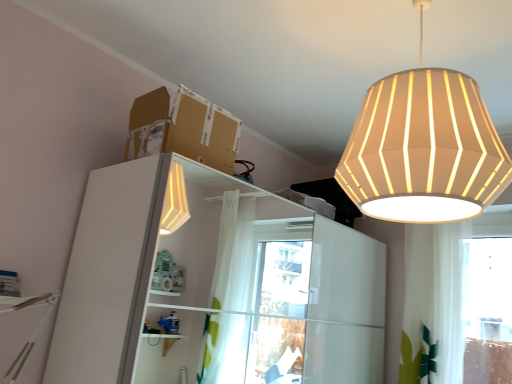
Question: Does white glossy dresser at left have a lesser width compared to white fabric lampshade at upper right?

Choices:
 (A) yes
 (B) no

Answer: (B)

Question: From the image's perspective, would you say white glossy dresser at left is shown under white fabric lampshade at upper right?

Choices:
 (A) no
 (B) yes

Answer: (B)

Question: Can you confirm if white glossy dresser at left is wider than white fabric lampshade at upper right?

Choices:
 (A) no
 (B) yes

Answer: (B)

Question: Is white glossy dresser at left taller than white fabric lampshade at upper right?

Choices:
 (A) yes
 (B) no

Answer: (A)

Question: From a real-world perspective, is white glossy dresser at left located beneath white fabric lampshade at upper right?

Choices:
 (A) no
 (B) yes

Answer: (B)

Question: Does white glossy dresser at left appear on the left side of white fabric lampshade at upper right?

Choices:
 (A) no
 (B) yes

Answer: (B)

Question: Is brown cardboard box at upper center taller than white fabric lampshade at upper right?

Choices:
 (A) yes
 (B) no

Answer: (B)

Question: From the image's perspective, is brown cardboard box at upper center on top of white fabric lampshade at upper right?

Choices:
 (A) no
 (B) yes

Answer: (A)

Question: Is brown cardboard box at upper center behind white fabric lampshade at upper right?

Choices:
 (A) no
 (B) yes

Answer: (B)

Question: From the image's perspective, is brown cardboard box at upper center beneath white fabric lampshade at upper right?

Choices:
 (A) yes
 (B) no

Answer: (A)

Question: Is white fabric lampshade at upper right surrounded by brown cardboard box at upper center?

Choices:
 (A) no
 (B) yes

Answer: (A)

Question: Is brown cardboard box at upper center shorter than white fabric lampshade at upper right?

Choices:
 (A) no
 (B) yes

Answer: (B)

Question: Is white glossy dresser at left not inside brown cardboard box at upper center?

Choices:
 (A) yes
 (B) no

Answer: (A)